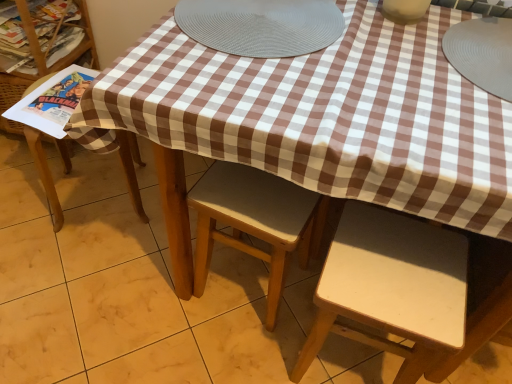
Question: Is point (193, 38) closer or farther from the camera than point (408, 331)?

Choices:
 (A) closer
 (B) farther

Answer: (B)

Question: Is gray textured placemat at center taller or shorter than white matte chair at lower right, positioned as the 3th chair in left-to-right order?

Choices:
 (A) tall
 (B) short

Answer: (B)

Question: Estimate the real-world distances between objects in this image. Which object is closer to the light brown wood chair at center, which appears as the second chair when viewed from the left?

Choices:
 (A) wooden chair at left, which ranks as the 1th chair in left-to-right order
 (B) gray textured placemat at center
 (C) white matte chair at lower right, positioned as the 3th chair in left-to-right order
 (D) gray rubber placemat at upper right, the 1th tableware viewed from the right
 (E) matte white vase at upper center, which is the 2th tableware from right to left

Answer: (C)

Question: Estimate the real-world distances between objects in this image. Which object is closer to the light brown wood chair at center, which is counted as the 2th chair, starting from the right?

Choices:
 (A) white matte chair at lower right, placed as the 1th chair when sorted from right to left
 (B) gray textured placemat at center
 (C) matte paper magazine at left
 (D) matte paper book at left
 (E) gray rubber placemat at upper right, the second tableware positioned from the left

Answer: (A)